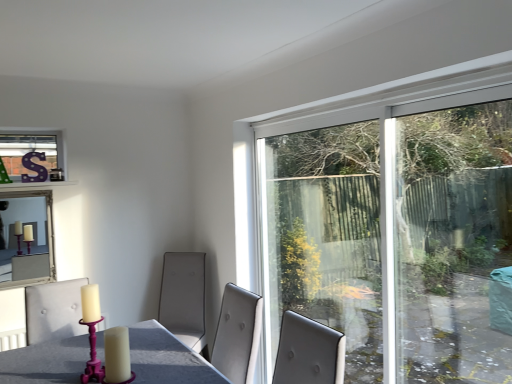
Question: Is transparent glass window at upper right located within silver-framed mirror at upper left?

Choices:
 (A) yes
 (B) no

Answer: (B)

Question: Is silver-framed mirror at upper left outside transparent glass window at upper right?

Choices:
 (A) no
 (B) yes

Answer: (B)

Question: From a real-world perspective, is silver-framed mirror at upper left below transparent glass window at upper right?

Choices:
 (A) yes
 (B) no

Answer: (A)

Question: Is silver-framed mirror at upper left smaller than transparent glass window at upper right?

Choices:
 (A) no
 (B) yes

Answer: (B)

Question: From a real-world perspective, does silver-framed mirror at upper left stand above transparent glass window at upper right?

Choices:
 (A) yes
 (B) no

Answer: (B)

Question: Is silver-framed mirror at upper left to the left of transparent glass window at upper right from the viewer's perspective?

Choices:
 (A) yes
 (B) no

Answer: (A)

Question: Can you confirm if transparent glass window at upper right is taller than silver-framed mirror at upper left?

Choices:
 (A) no
 (B) yes

Answer: (B)

Question: Is the depth of transparent glass window at upper right greater than that of silver-framed mirror at upper left?

Choices:
 (A) yes
 (B) no

Answer: (B)

Question: Can you confirm if transparent glass window at upper right is bigger than silver-framed mirror at upper left?

Choices:
 (A) no
 (B) yes

Answer: (B)

Question: From a real-world perspective, is transparent glass window at upper right beneath silver-framed mirror at upper left?

Choices:
 (A) yes
 (B) no

Answer: (B)

Question: Considering the relative sizes of transparent glass window at upper right and silver-framed mirror at upper left in the image provided, is transparent glass window at upper right smaller than silver-framed mirror at upper left?

Choices:
 (A) yes
 (B) no

Answer: (B)

Question: Can we say transparent glass window at upper right lies outside silver-framed mirror at upper left?

Choices:
 (A) yes
 (B) no

Answer: (A)

Question: Considering the positions of point (10, 195) and point (262, 233), is point (10, 195) closer or farther from the camera than point (262, 233)?

Choices:
 (A) farther
 (B) closer

Answer: (A)